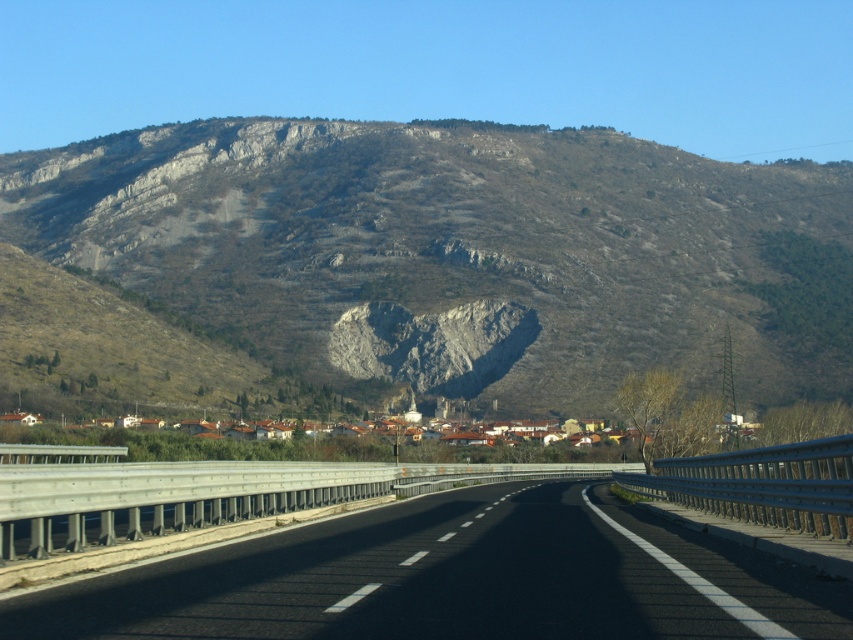
Who is shorter, gray rocky mountain at center or black asphalt highway at center?

Standing shorter between the two is black asphalt highway at center.

Locate an element on the screen. gray rocky mountain at center is located at coordinates (462, 252).